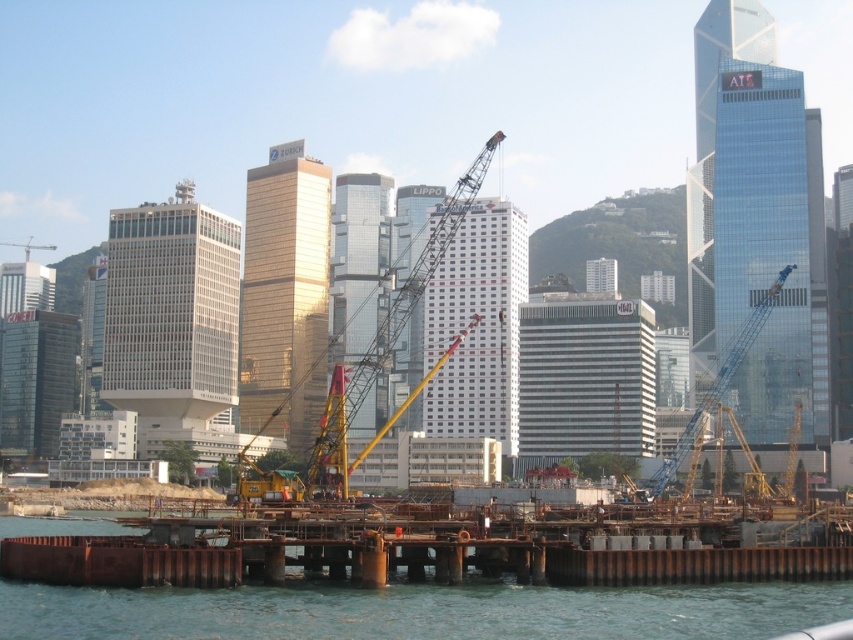
Question: Which object is the farthest from the rusty metal water at lower center?

Choices:
 (A) blue metallic crane at center
 (B) yellow metallic crane at center

Answer: (A)

Question: Can you confirm if yellow metallic crane at center is thinner than blue metallic crane at center?

Choices:
 (A) yes
 (B) no

Answer: (B)

Question: Can you confirm if rusty metal water at lower center is bigger than blue metallic crane at center?

Choices:
 (A) no
 (B) yes

Answer: (B)

Question: Which is nearer to the rusty metal water at lower center?

Choices:
 (A) yellow metallic crane at center
 (B) blue metallic crane at center

Answer: (A)

Question: Is rusty metal water at lower center bigger than blue metallic crane at center?

Choices:
 (A) yes
 (B) no

Answer: (A)

Question: Which object is farther from the camera taking this photo?

Choices:
 (A) rusty metal water at lower center
 (B) yellow metallic crane at center
 (C) blue metallic crane at center

Answer: (C)